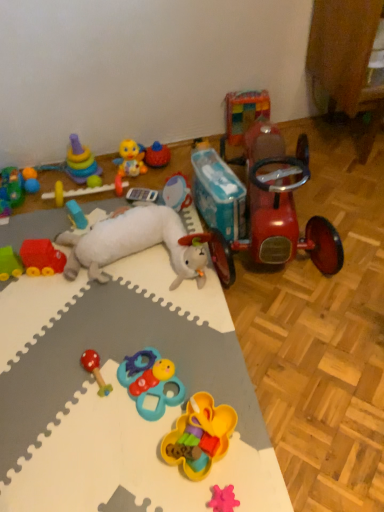
Find the location of `vacant area on the back side of wooden/matte rattle at lower left, marked as the 9th toy in a right-to-left arrangement`. vacant area on the back side of wooden/matte rattle at lower left, marked as the 9th toy in a right-to-left arrangement is located at coordinates (103, 328).